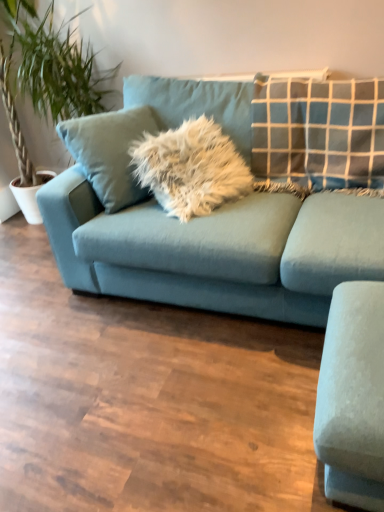
This screenshot has width=384, height=512. Describe the element at coordinates (47, 72) in the screenshot. I see `green leafy plant at left` at that location.

What do you see at coordinates (217, 250) in the screenshot?
I see `matte blue couch at center` at bounding box center [217, 250].

At what (x,y) coordinates should I click in order to perform the action: click on green leafy plant at left. Please return your answer as a coordinate pair (x, y). Looking at the image, I should click on (47, 72).

Can we say green leafy plant at left lies outside matte blue couch at center?

Yes, green leafy plant at left is located beyond the bounds of matte blue couch at center.

Is green leafy plant at left wider or thinner than matte blue couch at center?

green leafy plant at left is thinner than matte blue couch at center.

Is green leafy plant at left to the left of matte blue couch at center from the viewer's perspective?

Correct, you'll find green leafy plant at left to the left of matte blue couch at center.

Considering the relative sizes of matte blue couch at center and green leafy plant at left in the image provided, is matte blue couch at center wider than green leafy plant at left?

Correct, the width of matte blue couch at center exceeds that of green leafy plant at left.

Considering the positions of objects matte blue couch at center and green leafy plant at left in the image provided, who is more to the right, matte blue couch at center or green leafy plant at left?

matte blue couch at center.

Is matte blue couch at center positioned with its back to green leafy plant at left?

No, matte blue couch at center's orientation is not away from green leafy plant at left.

From the image's perspective, between matte blue couch at center and green leafy plant at left, who is located below?

From the image's view, matte blue couch at center is below.

How distant is green leafy plant at left from white ceramic pot at left?

They are 57.29 centimeters apart.

Does green leafy plant at left lie behind white ceramic pot at left?

No, it is in front of white ceramic pot at left.

Considering the sizes of objects green leafy plant at left and white ceramic pot at left in the image provided, who is wider, green leafy plant at left or white ceramic pot at left?

With larger width is green leafy plant at left.

From the image's perspective, is green leafy plant at left below white ceramic pot at left?

No, from the image's perspective, green leafy plant at left is not below white ceramic pot at left.

From the image's perspective, is white ceramic pot at left positioned above or below green leafy plant at left?

Based on their image positions, white ceramic pot at left is located beneath green leafy plant at left.

How many degrees apart are the facing directions of white ceramic pot at left and green leafy plant at left?

They differ by 90.9 degrees in their facing directions.

In the image, is white ceramic pot at left on the left side or the right side of green leafy plant at left?

Based on their positions, white ceramic pot at left is located to the left of green leafy plant at left.

Does white ceramic pot at left have a greater height compared to green leafy plant at left?

No.

What's the angular difference between white ceramic pot at left and matte blue couch at center's facing directions?

There is a 88.6-degree angle between the facing directions of white ceramic pot at left and matte blue couch at center.

Is white ceramic pot at left oriented away from matte blue couch at center?

No, white ceramic pot at left is not facing away from matte blue couch at center.

Does white ceramic pot at left have a lesser height compared to matte blue couch at center?

Indeed, white ceramic pot at left has a lesser height compared to matte blue couch at center.

How many degrees apart are the facing directions of matte blue couch at center and white ceramic pot at left?

They differ by 88.6 degrees in their facing directions.

Is matte blue couch at center looking in the opposite direction of white ceramic pot at left?

No, matte blue couch at center is not facing the opposite direction of white ceramic pot at left.

Which object is closer to the camera, matte blue couch at center or white ceramic pot at left?

matte blue couch at center is in front.

Between matte blue couch at center and white ceramic pot at left, which one has smaller width?

With smaller width is white ceramic pot at left.

Find the location of a particular element. This screenshot has height=512, width=384. studio couch below the green leafy plant at left (from the image's perspective) is located at coordinates (217, 250).

The height and width of the screenshot is (512, 384). I want to click on houseplant behind the matte blue couch at center, so click(47, 72).

From the image, which object appears to be nearer to green leafy plant at left, matte blue couch at center or white ceramic pot at left?

Among the two, white ceramic pot at left is located nearer to green leafy plant at left.

When comparing their distances from matte blue couch at center, does white ceramic pot at left or green leafy plant at left seem further?

Based on the image, white ceramic pot at left appears to be further to matte blue couch at center.

From the image, which object appears to be farther from green leafy plant at left, white ceramic pot at left or matte blue couch at center?

matte blue couch at center.

When comparing their distances from matte blue couch at center, does green leafy plant at left or white ceramic pot at left seem further?

white ceramic pot at left is positioned further to the anchor matte blue couch at center.

From the image, which object appears to be nearer to white ceramic pot at left, green leafy plant at left or matte blue couch at center?

green leafy plant at left is closer to white ceramic pot at left.

From the picture: From the image, which object appears to be farther from white ceramic pot at left, matte blue couch at center or green leafy plant at left?

Among the two, matte blue couch at center is located further to white ceramic pot at left.

Find the location of a particular element. houseplant between matte blue couch at center and white ceramic pot at left in the front-back direction is located at coordinates (47, 72).